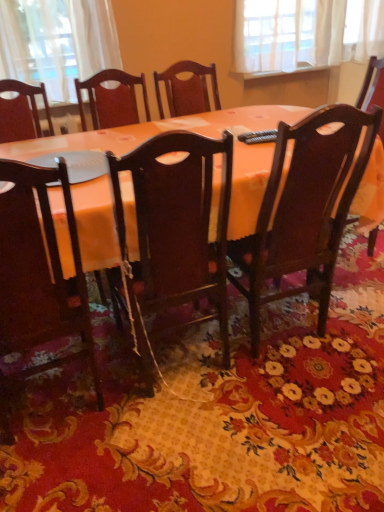
Question: In the image, is matte orange table at center on the left side or the right side of matte dark wood chair at lower left, the 3th chair in the right-to-left sequence?

Choices:
 (A) right
 (B) left

Answer: (A)

Question: In terms of height, does matte orange table at center look taller or shorter compared to matte dark wood chair at lower left, the 3th chair in the right-to-left sequence?

Choices:
 (A) short
 (B) tall

Answer: (A)

Question: Estimate the real-world distances between objects in this image. Which object is closer to the yellow fabric mat at center?

Choices:
 (A) matte orange table at center
 (B) matte dark wood chair at lower left, marked as the 1th chair in a left-to-right arrangement
 (C) wooden chair at center, placed as the second chair when sorted from right to left
 (D) polished dark wood chair at center, the first chair viewed from the right

Answer: (C)

Question: Which is nearer to the yellow fabric mat at center?

Choices:
 (A) matte orange table at center
 (B) polished dark wood chair at center, the first chair viewed from the right
 (C) matte dark wood chair at lower left, the 3th chair in the right-to-left sequence
 (D) wooden chair at center, which appears as the second chair when viewed from the left

Answer: (D)